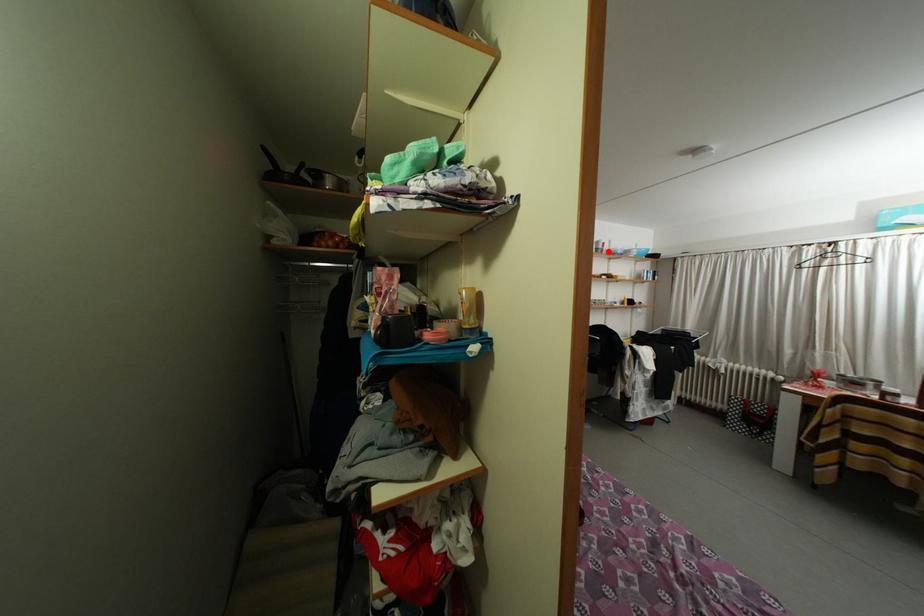
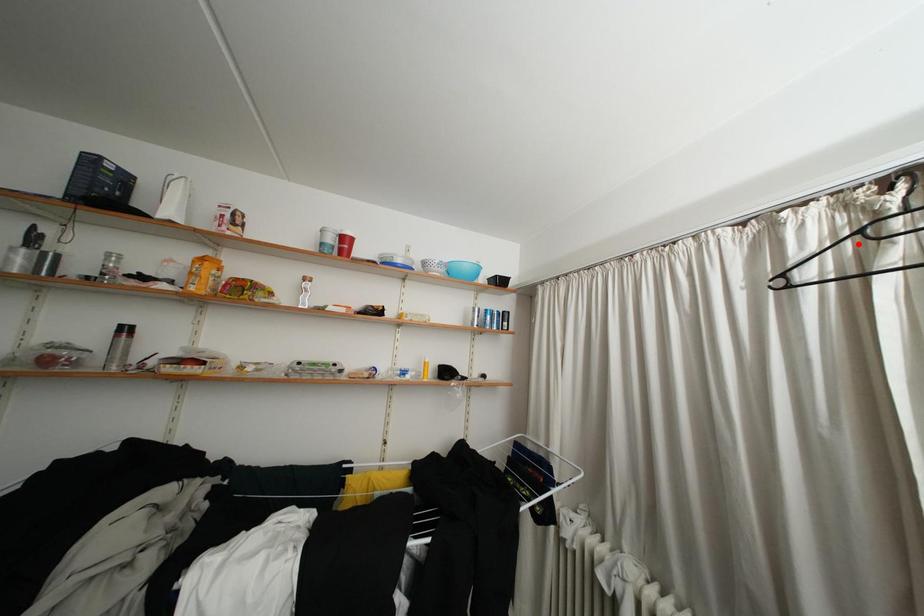
I am providing you with two images of the same scene from different viewpoints. A red point is marked on the first image and another point is marked on the second image. Is the marked point in image1 the same physical position as the marked point in image2?

No